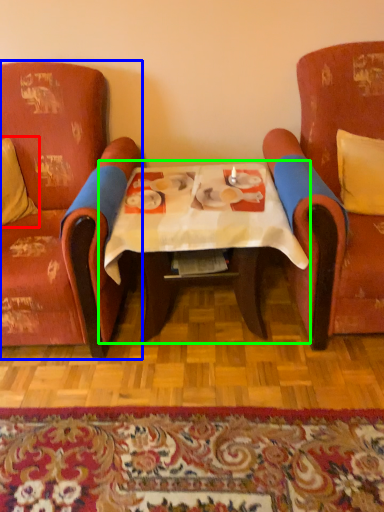
Question: Which is nearer to the pillow (highlighted by a red box)? chair (highlighted by a blue box) or table (highlighted by a green box).

Choices:
 (A) chair
 (B) table

Answer: (A)